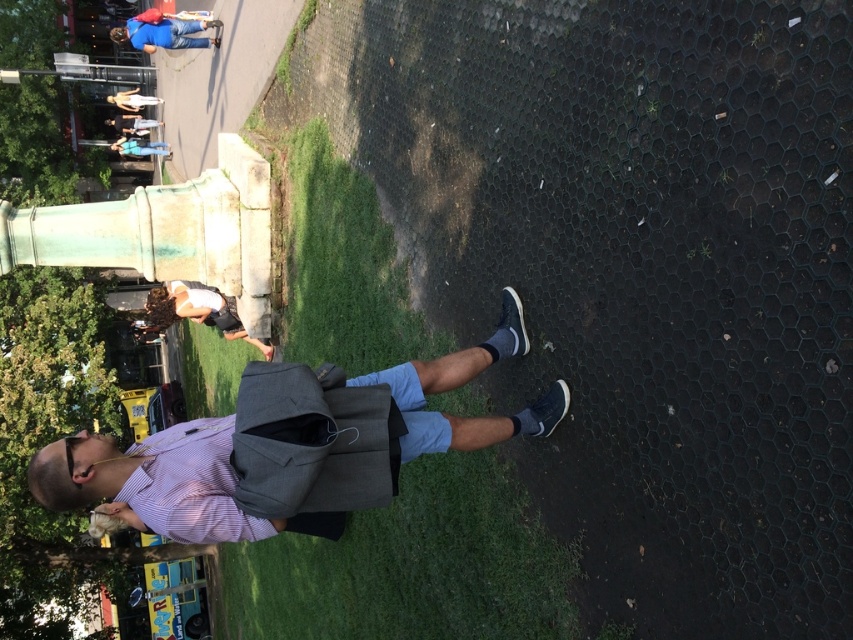
In the scene shown: Who is positioned more to the right, matte gray backpack at center or matte blue jeans at upper left?

From the viewer's perspective, matte gray backpack at center appears more on the right side.

Is matte gray backpack at center smaller than matte blue jeans at upper left?

Yes, matte gray backpack at center is smaller than matte blue jeans at upper left.

Measure the distance between point (132, 472) and camera.

They are 4.37 meters apart.

At what (x,y) coordinates should I click in order to perform the action: click on matte gray backpack at center. Please return your answer as a coordinate pair (x, y). This screenshot has width=853, height=640. Looking at the image, I should click on (288, 448).

Is white cotton tank top at center positioned in front of matte blue jeans at upper left?

Yes, it is in front of matte blue jeans at upper left.

Which is above, white cotton tank top at center or matte blue jeans at upper left?

matte blue jeans at upper left is higher up.

Image resolution: width=853 pixels, height=640 pixels. I want to click on white cotton tank top at center, so click(x=198, y=310).

The height and width of the screenshot is (640, 853). What do you see at coordinates (288, 448) in the screenshot? I see `matte gray backpack at center` at bounding box center [288, 448].

Which is in front, point (215, 442) or point (129, 129)?

Point (215, 442)

Between point (372, 394) and point (125, 115), which one is positioned behind?

Positioned behind is point (125, 115).

Image resolution: width=853 pixels, height=640 pixels. In order to click on matte gray backpack at center in this screenshot , I will do `click(288, 448)`.